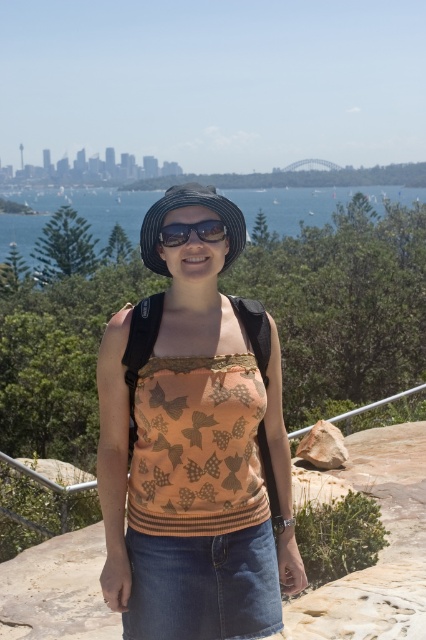
Which is below, black woven hat at center or matte black sunglasses at center?

matte black sunglasses at center is below.

Is point (181, 204) in front of point (199, 220)?

Yes.

Which is behind, point (158, 259) or point (212, 236)?

Point (158, 259)

Image resolution: width=426 pixels, height=640 pixels. I want to click on black woven hat at center, so click(x=189, y=205).

Is matte black hat at center below blue water at center?

Yes.

Who is positioned more to the left, matte black hat at center or blue water at center?

From the viewer's perspective, blue water at center appears more on the left side.

Locate an element on the screen. The height and width of the screenshot is (640, 426). matte black hat at center is located at coordinates click(193, 449).

Identify the location of matte black hat at center. The height and width of the screenshot is (640, 426). (193, 449).

Which is more to the left, matte black hat at center or matte black sunglasses at center?

From the viewer's perspective, matte black hat at center appears more on the left side.

This screenshot has width=426, height=640. What do you see at coordinates (193, 449) in the screenshot?
I see `matte black hat at center` at bounding box center [193, 449].

Locate an element on the screen. matte black hat at center is located at coordinates (193, 449).